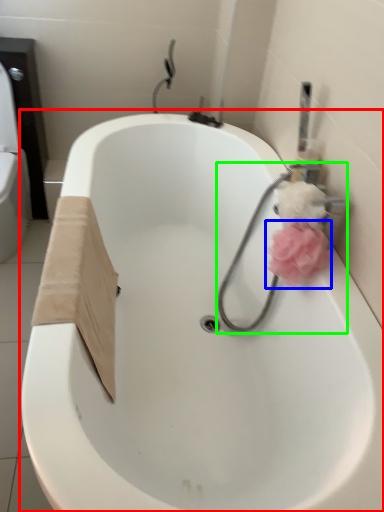
Question: Based on their relative distances, which object is farther from bathtub (highlighted by a red box)? Choose from flower (highlighted by a blue box) and plumbing fixture (highlighted by a green box).

Choices:
 (A) flower
 (B) plumbing fixture

Answer: (A)